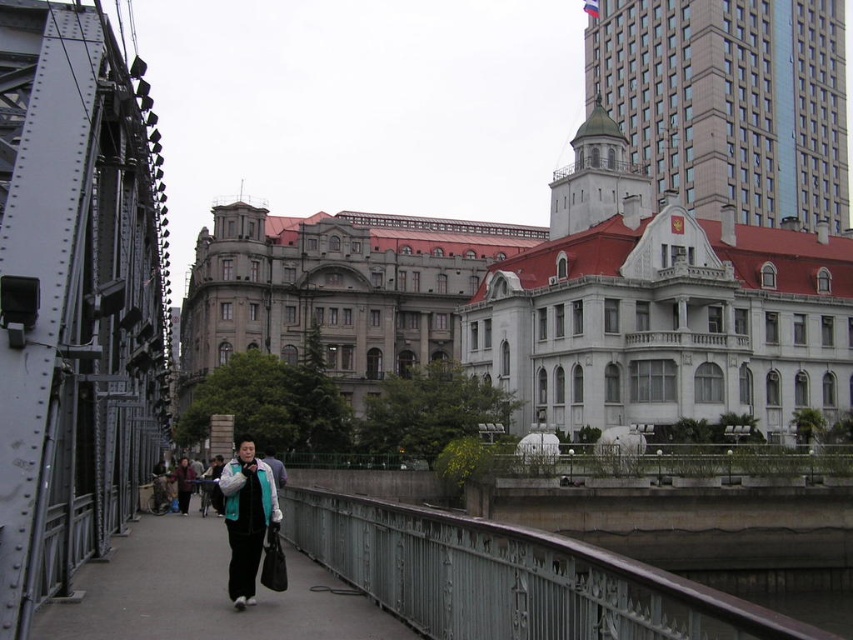
Question: Which point is closer to the camera?

Choices:
 (A) pos(230,496)
 (B) pos(213,474)
 (C) pos(514,573)

Answer: (C)

Question: Can you confirm if metallic gray pedestrian bridge at center is positioned to the right of black leather jacket at center?

Choices:
 (A) yes
 (B) no

Answer: (A)

Question: Is metallic gray pedestrian bridge at center positioned at the back of black fabric bag at center?

Choices:
 (A) no
 (B) yes

Answer: (A)

Question: Is black fabric bag at center above teal fabric jacket at center?

Choices:
 (A) yes
 (B) no

Answer: (B)

Question: Which of the following is the closest to the observer?

Choices:
 (A) black fabric bag at center
 (B) black leather jacket at center
 (C) metallic gray pedestrian bridge at center

Answer: (C)

Question: Among these objects, which one is nearest to the camera?

Choices:
 (A) metallic gray pedestrian bridge at center
 (B) black fabric bag at center
 (C) teal fabric jacket at center

Answer: (A)